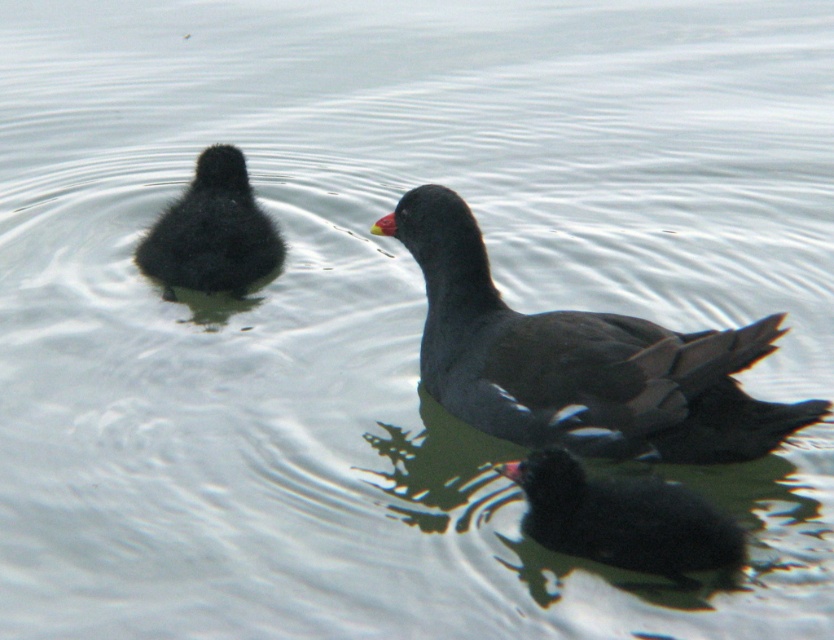
You are a photographer trying to capture both the black matte duckling at lower right and the black matte duckling at upper left in a single frame. Based on their positions, which duckling is closer to the camera?

The black matte duckling at lower right is closer to the camera because it appears wider than the black matte duckling at upper left.

You are a photographer trying to capture both the dark gray matte duck at center and the black matte duckling at lower right in a single shot. Given their positions, which duck is closer to the camera and thus larger in the photo?

The dark gray matte duck at center is closer to the camera than the black matte duckling at lower right, so it appears larger in the photo.

You are a photographer trying to capture a clear photo of the black matte duckling at lower right and the black matte duckling at upper left. Which duckling is closer to the camera and will appear larger in the photo?

The black matte duckling at lower right is in front of the black matte duckling at upper left, so it will appear larger in the photo.